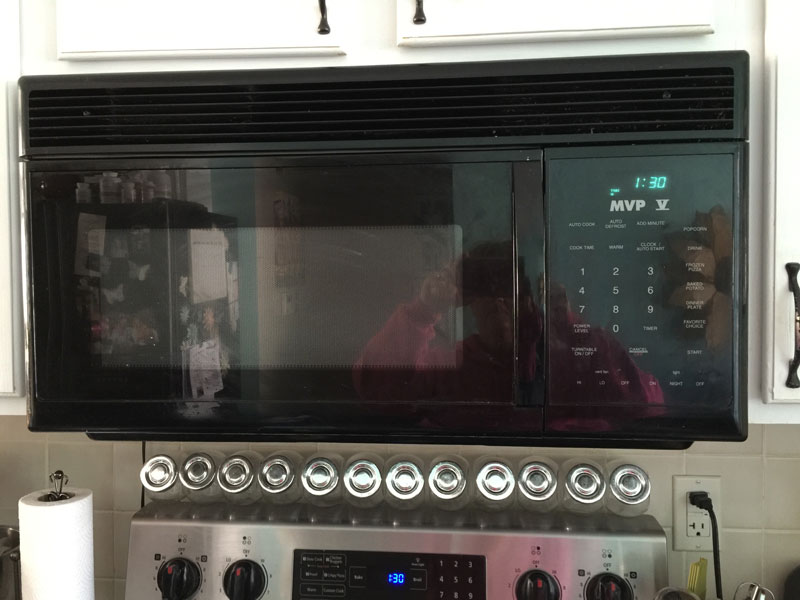
You are a GUI agent. You are given a task and a screenshot of the screen. Output one action in this format:
    pyautogui.click(x=<x>, y=<y>)
    Task: Click on the electrical plug
    Image resolution: width=800 pixels, height=600 pixels.
    Given the screenshot: What is the action you would take?
    pyautogui.click(x=704, y=500)